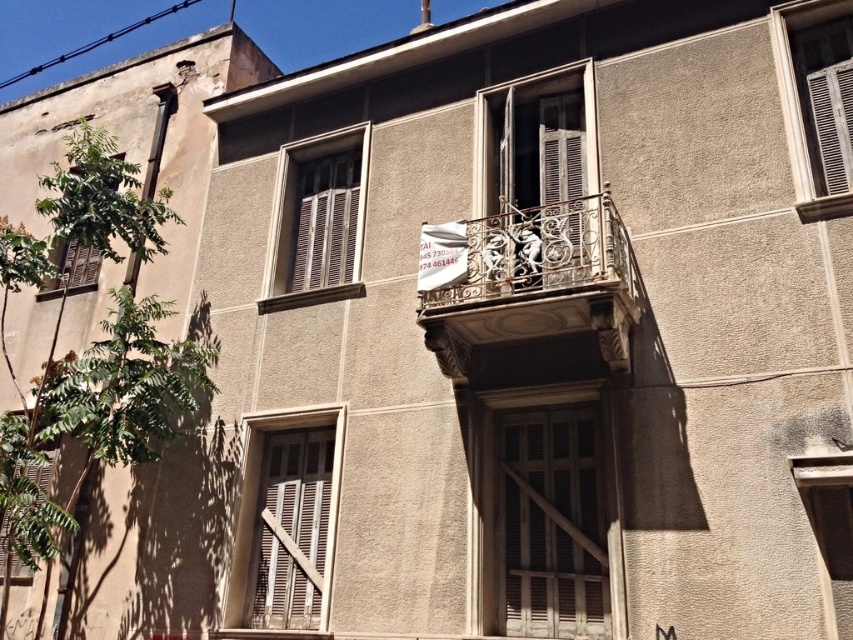
You are standing in front of the building and notice the wrought iron balcony at center and the white wooden shutter at center. Which one is positioned to the left when viewed from the front?

The wrought iron balcony at center is positioned to the left of the white wooden shutter at center when viewed from the front.

You are standing in front of the building and want to touch both points on the wall. Which point should you reach for first, the point at coordinates (515, 250) or the point at (556, 234)?

You should reach for the point at coordinates (515, 250) first because it is closer to you than the point at (556, 234), which is further away.

You are standing in front of the building and notice a point marked at coordinates (285, 520). Based on the scene description, what object does this point most likely represent?

The point at (285, 520) corresponds to the white wooden window at center.